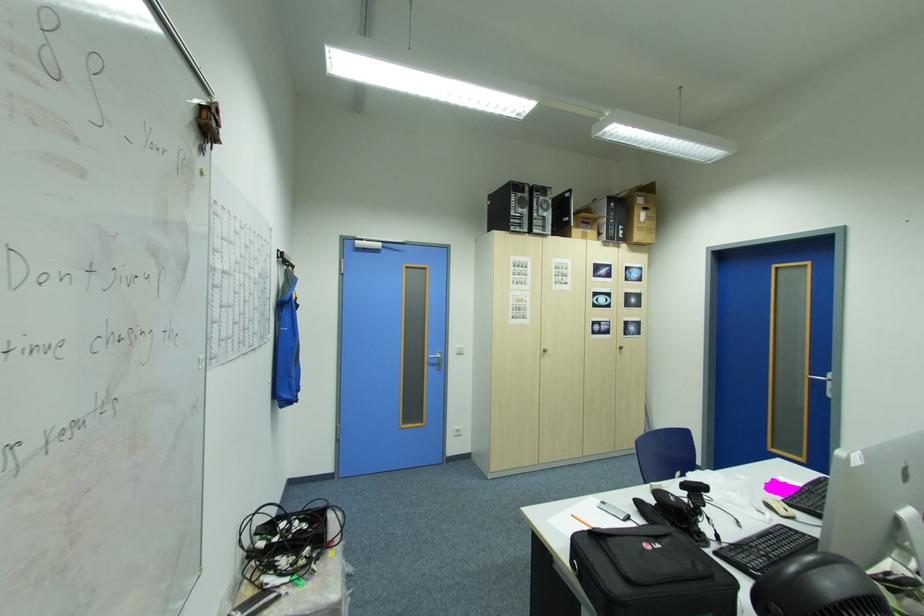
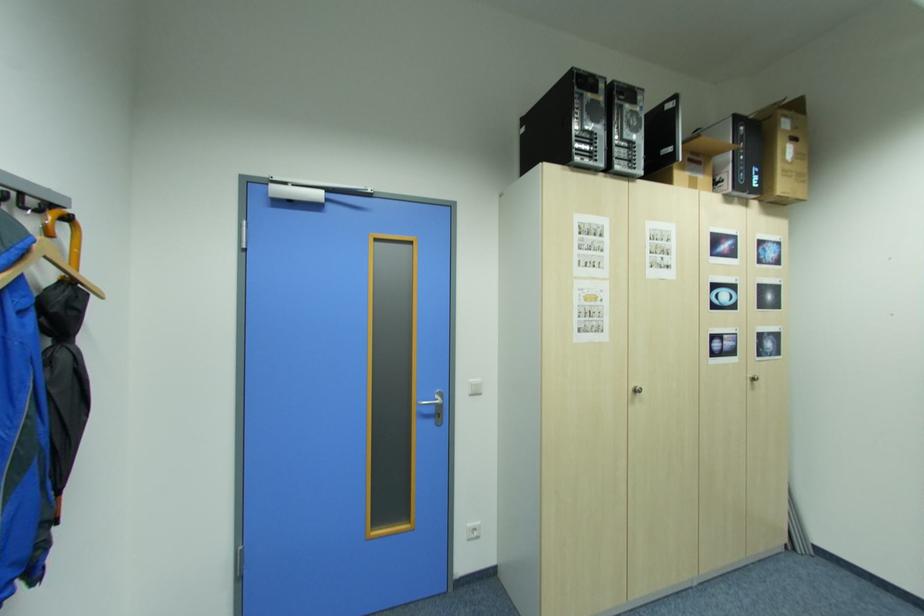
Find the pixel in the second image that matches point 442,370 in the first image.

(438, 424)